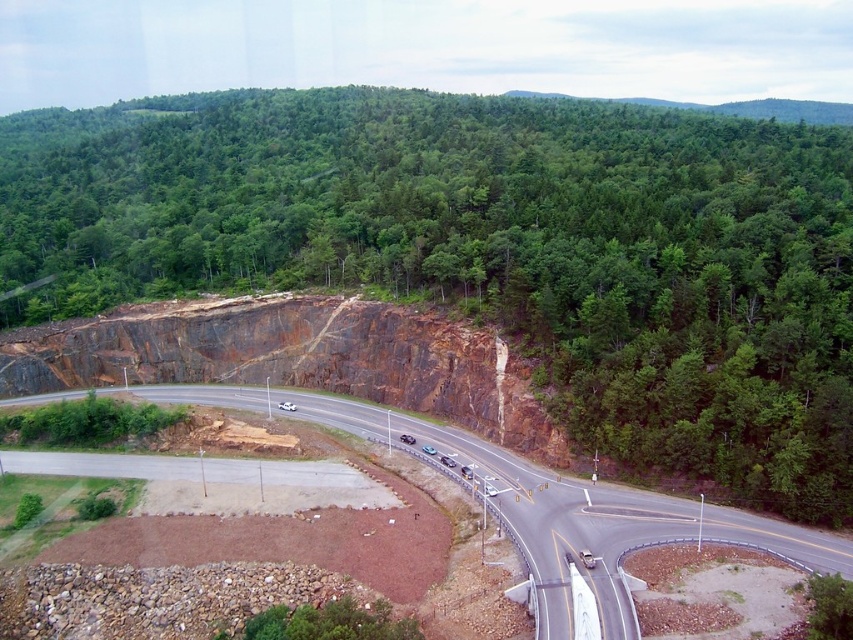
Question: Does green leafy tree at center appear on the left side of asphalt road at center?

Choices:
 (A) no
 (B) yes

Answer: (B)

Question: Where is green leafy tree at center located in relation to asphalt road at center in the image?

Choices:
 (A) above
 (B) below

Answer: (A)

Question: Can you confirm if green leafy tree at center is smaller than asphalt road at center?

Choices:
 (A) yes
 (B) no

Answer: (B)

Question: Which point appears farthest from the camera in this image?

Choices:
 (A) (676, 536)
 (B) (13, 224)

Answer: (B)